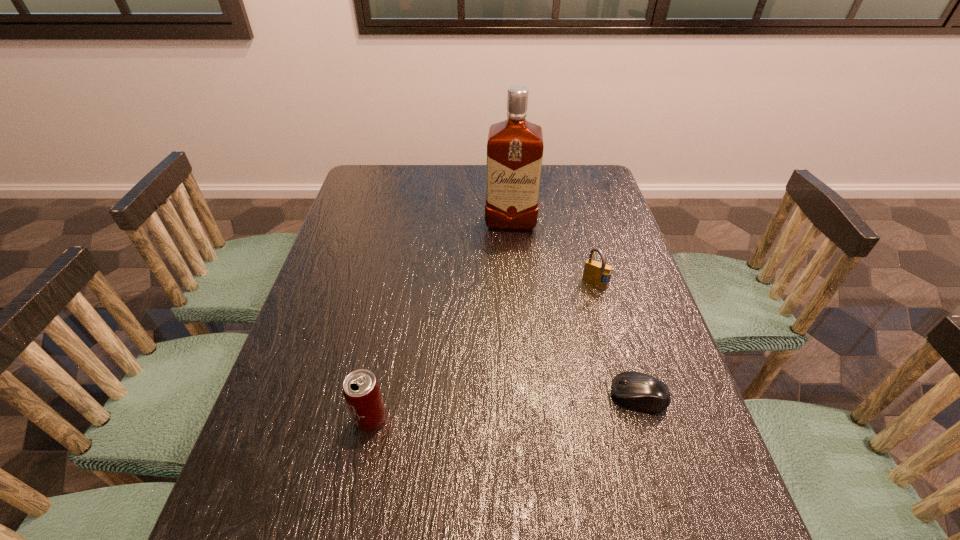
The image size is (960, 540). Find the location of `free space on the desktop that is between the beer can and the shortest object and is positioned on the side with the combination dials of the padlock`. free space on the desktop that is between the beer can and the shortest object and is positioned on the side with the combination dials of the padlock is located at coordinates (543, 404).

What are the coordinates of `free space on the desktop that is between the beer can and the shortest object and is positioned on the front label of the tallest object` in the screenshot? It's located at (504, 408).